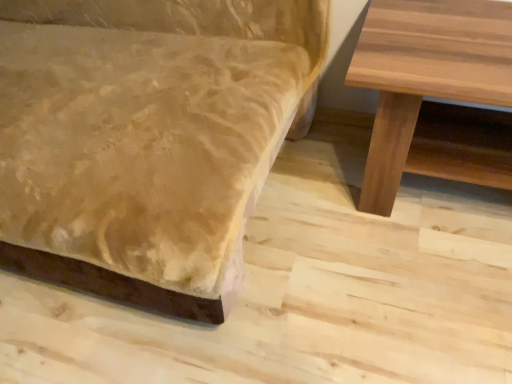
What do you see at coordinates (432, 90) in the screenshot? This screenshot has height=384, width=512. I see `natural wood table at right` at bounding box center [432, 90].

I want to click on natural wood table at right, so click(432, 90).

Measure the distance between natural wood table at right and camera.

A distance of 33.58 inches exists between natural wood table at right and camera.

What is the approximate height of natural wood table at right?

natural wood table at right is 20.07 inches in height.

The height and width of the screenshot is (384, 512). Describe the element at coordinates (197, 24) in the screenshot. I see `velvet-like beige couch at lower left` at that location.

Locate an element on the screen. This screenshot has height=384, width=512. velvet-like beige couch at lower left is located at coordinates (197, 24).

Where is `natural wood table at right`? natural wood table at right is located at coordinates (432, 90).

Which is more to the left, velvet-like beige couch at lower left or natural wood table at right?

velvet-like beige couch at lower left.

Considering their positions, is velvet-like beige couch at lower left located in front of or behind natural wood table at right?

Visually, velvet-like beige couch at lower left is located in front of natural wood table at right.

Is point (25, 273) positioned before point (426, 55)?

No, it is behind (426, 55).

From the image's perspective, is velvet-like beige couch at lower left below natural wood table at right?

No, from the image's perspective, velvet-like beige couch at lower left is not beneath natural wood table at right.

From a real-world perspective, which object stands above the other?

From a 3D spatial view, velvet-like beige couch at lower left is above.

Is velvet-like beige couch at lower left wider than natural wood table at right?

Correct, the width of velvet-like beige couch at lower left exceeds that of natural wood table at right.

Considering the sizes of velvet-like beige couch at lower left and natural wood table at right in the image, is velvet-like beige couch at lower left taller or shorter than natural wood table at right?

Clearly, velvet-like beige couch at lower left is taller compared to natural wood table at right.

Looking at the image, does velvet-like beige couch at lower left seem bigger or smaller compared to natural wood table at right?

Clearly, velvet-like beige couch at lower left is larger in size than natural wood table at right.

Is velvet-like beige couch at lower left inside the boundaries of natural wood table at right, or outside?

velvet-like beige couch at lower left cannot be found inside natural wood table at right.

Would you say velvet-like beige couch at lower left is a long distance from natural wood table at right?

They are positioned close to each other.

Is velvet-like beige couch at lower left oriented away from natural wood table at right?

velvet-like beige couch at lower left is not turned away from natural wood table at right.

What's the angular difference between velvet-like beige couch at lower left and natural wood table at right's facing directions?

The facing directions of velvet-like beige couch at lower left and natural wood table at right are 1.01 degrees apart.

How much distance is there between velvet-like beige couch at lower left and natural wood table at right?

They are 15.92 inches apart.

The height and width of the screenshot is (384, 512). I want to click on table behind the velvet-like beige couch at lower left, so click(432, 90).

Considering the positions of objects natural wood table at right and velvet-like beige couch at lower left in the image provided, who is more to the left, natural wood table at right or velvet-like beige couch at lower left?

velvet-like beige couch at lower left.

Is natural wood table at right positioned before velvet-like beige couch at lower left?

No, it is behind velvet-like beige couch at lower left.

Which is behind, point (358, 51) or point (210, 6)?

Point (210, 6)

From the image's perspective, would you say natural wood table at right is shown under velvet-like beige couch at lower left?

Indeed, from the image's perspective, natural wood table at right is shown beneath velvet-like beige couch at lower left.

From a real-world perspective, which object stands above the other?

velvet-like beige couch at lower left, from a real-world perspective.

Considering the sizes of objects natural wood table at right and velvet-like beige couch at lower left in the image provided, who is wider, natural wood table at right or velvet-like beige couch at lower left?

velvet-like beige couch at lower left.

Considering the relative sizes of natural wood table at right and velvet-like beige couch at lower left in the image provided, is natural wood table at right shorter than velvet-like beige couch at lower left?

Indeed, natural wood table at right has a lesser height compared to velvet-like beige couch at lower left.

Considering the relative sizes of natural wood table at right and velvet-like beige couch at lower left in the image provided, is natural wood table at right bigger than velvet-like beige couch at lower left?

No.

Choose the correct answer: Is natural wood table at right inside velvet-like beige couch at lower left or outside it?

natural wood table at right lies outside velvet-like beige couch at lower left.

Consider the image. Is natural wood table at right positioned far away from velvet-like beige couch at lower left?

Actually, natural wood table at right and velvet-like beige couch at lower left are a little close together.

Is natural wood table at right oriented away from velvet-like beige couch at lower left?

natural wood table at right does not have its back to velvet-like beige couch at lower left.

Consider the image. Can you tell me how much natural wood table at right and velvet-like beige couch at lower left differ in facing direction?

The angular difference between natural wood table at right and velvet-like beige couch at lower left is 1.01 degrees.

Where is `table below the velvet-like beige couch at lower left (from the image's perspective)`? The width and height of the screenshot is (512, 384). table below the velvet-like beige couch at lower left (from the image's perspective) is located at coordinates (432, 90).

The image size is (512, 384). I want to click on studio couch in front of the natural wood table at right, so click(197, 24).

Image resolution: width=512 pixels, height=384 pixels. In order to click on studio couch above the natural wood table at right (from a real-world perspective) in this screenshot , I will do `click(197, 24)`.